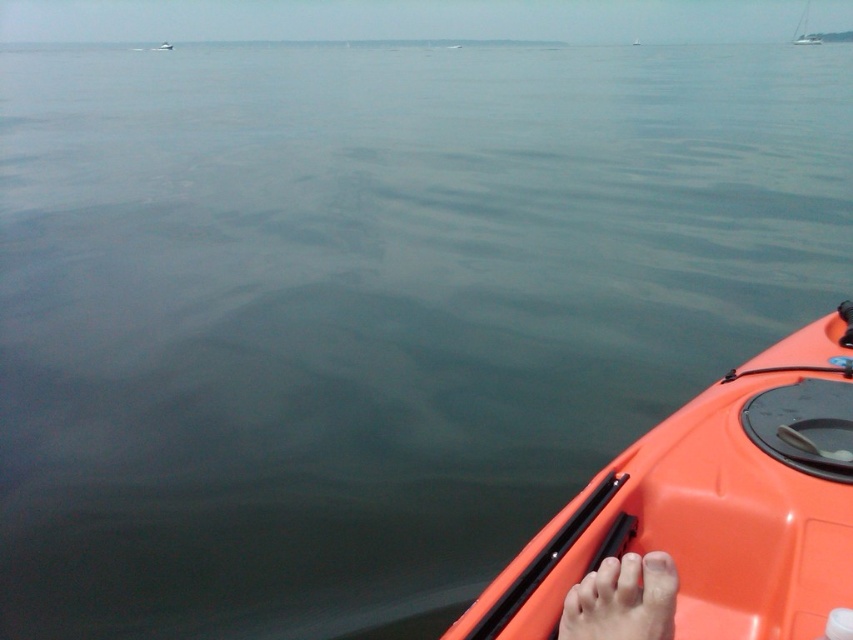
Can you confirm if skinny barefoot at lower right is thinner than white sailboat at upper right?

Correct, skinny barefoot at lower right's width is less than white sailboat at upper right's.

Does skinny barefoot at lower right come behind white sailboat at upper right?

That is False.

The height and width of the screenshot is (640, 853). Find the location of `skinny barefoot at lower right`. skinny barefoot at lower right is located at coordinates (622, 600).

Is orange plastic kayak at lower right wider than skinny barefoot at lower right?

Yes, orange plastic kayak at lower right is wider than skinny barefoot at lower right.

Between orange plastic kayak at lower right and skinny barefoot at lower right, which one is positioned higher?

orange plastic kayak at lower right is above.

Identify the location of orange plastic kayak at lower right. (714, 506).

The image size is (853, 640). Find the location of `orange plastic kayak at lower right`. orange plastic kayak at lower right is located at coordinates (714, 506).

Is orange plastic kayak at lower right to the left of white sailboat at upper right from the viewer's perspective?

Indeed, orange plastic kayak at lower right is positioned on the left side of white sailboat at upper right.

The image size is (853, 640). Find the location of `orange plastic kayak at lower right`. orange plastic kayak at lower right is located at coordinates (714, 506).

Between point (550, 570) and point (810, 0), which one is positioned behind?

Point (810, 0)

The width and height of the screenshot is (853, 640). I want to click on orange plastic kayak at lower right, so click(714, 506).